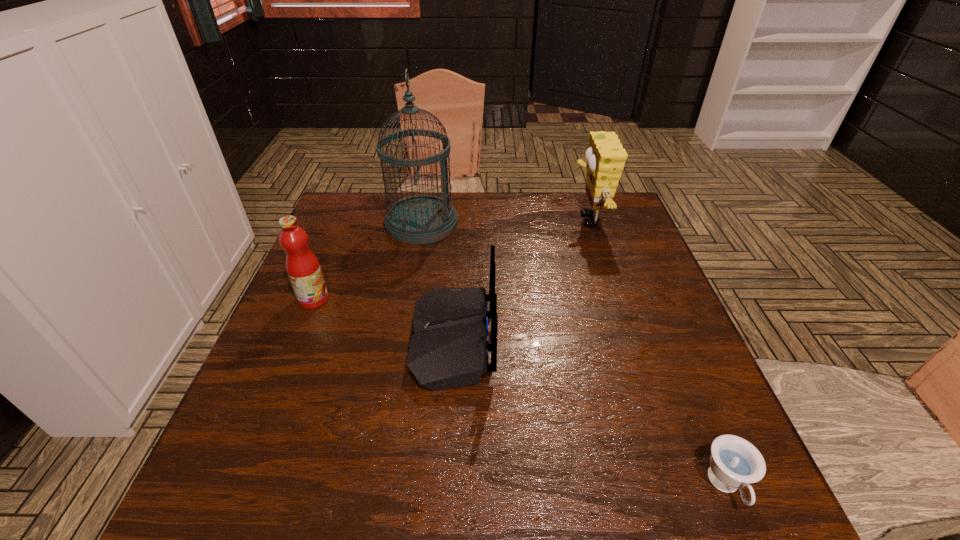
Image resolution: width=960 pixels, height=540 pixels. What are the coordinates of `birdcage` in the screenshot? It's located at (418, 219).

Where is `sponge`? Image resolution: width=960 pixels, height=540 pixels. sponge is located at coordinates (605, 156).

Locate an element on the screen. Image resolution: width=960 pixels, height=540 pixels. fruit juice is located at coordinates (303, 268).

You are a GUI agent. You are given a task and a screenshot of the screen. Output one action in this format:
    pyautogui.click(x=<x>, y=<y>)
    Task: Click on the second shortest object
    
    Given the screenshot: What is the action you would take?
    pyautogui.click(x=449, y=347)

Find the location of a particular element. The width and height of the screenshot is (960, 540). the nearest object is located at coordinates (734, 462).

Locate an element on the screen. This screenshot has width=960, height=540. the shortest object is located at coordinates (734, 462).

This screenshot has width=960, height=540. I want to click on free region located 0.110m on the front-facing side of the birdcage, so click(x=494, y=223).

Find the location of a particular element. vacant region located 0.100m on the front-facing side of the sponge is located at coordinates (535, 220).

Locate an element on the screen. The image size is (960, 540). vacant space situated 0.140m on the front-facing side of the sponge is located at coordinates (521, 220).

Where is `vacant area situated 0.210m on the front-facing side of the sponge`? This screenshot has height=540, width=960. vacant area situated 0.210m on the front-facing side of the sponge is located at coordinates (498, 220).